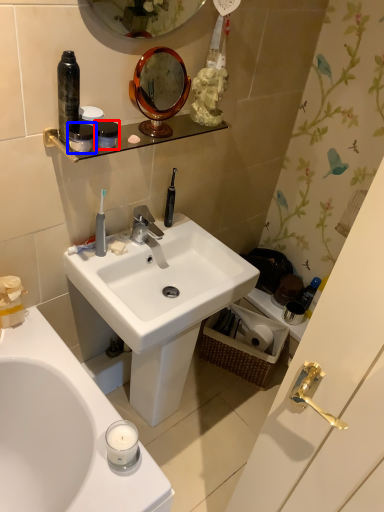
Question: Which of the following is the closest to the observer, mouthwash (highlighted by a red box) or mouthwash (highlighted by a blue box)?

Choices:
 (A) mouthwash
 (B) mouthwash

Answer: (B)